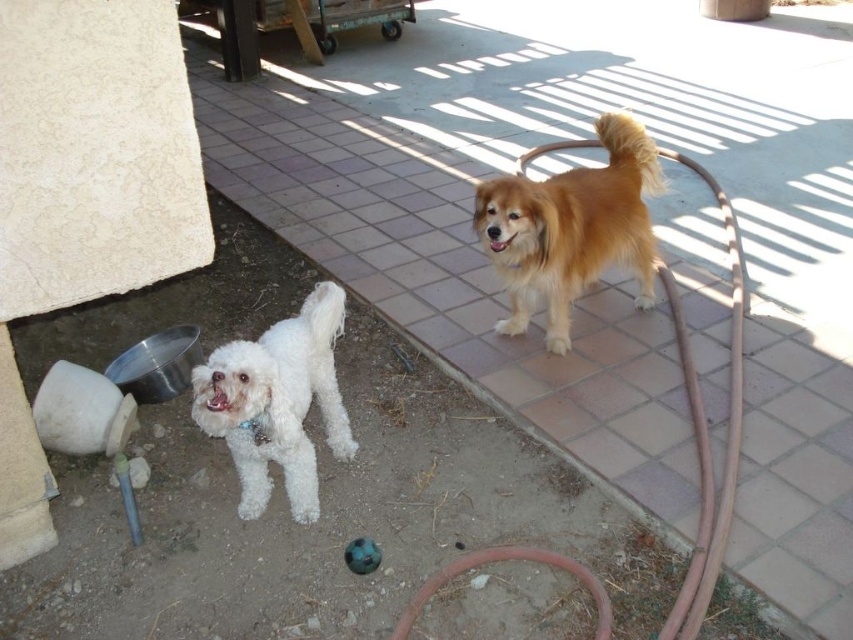
Question: Estimate the real-world distances between objects in this image. Which object is closer to the golden fur dog at upper right?

Choices:
 (A) brown rubber hose at upper right
 (B) white fluffy dog at lower left

Answer: (A)

Question: Which object appears closest to the camera in this image?

Choices:
 (A) white fluffy dog at lower left
 (B) brown rubber hose at upper right

Answer: (A)

Question: Which object is closer to the camera taking this photo?

Choices:
 (A) white fluffy dog at lower left
 (B) brown rubber hose at upper right
 (C) rubber hose at lower center
 (D) golden fur dog at upper right

Answer: (A)

Question: Can you confirm if golden fur dog at upper right is positioned above rubber hose at lower center?

Choices:
 (A) no
 (B) yes

Answer: (B)

Question: Is golden fur dog at upper right bigger than white fluffy dog at lower left?

Choices:
 (A) yes
 (B) no

Answer: (A)

Question: Does golden fur dog at upper right appear over rubber hose at lower center?

Choices:
 (A) no
 (B) yes

Answer: (B)